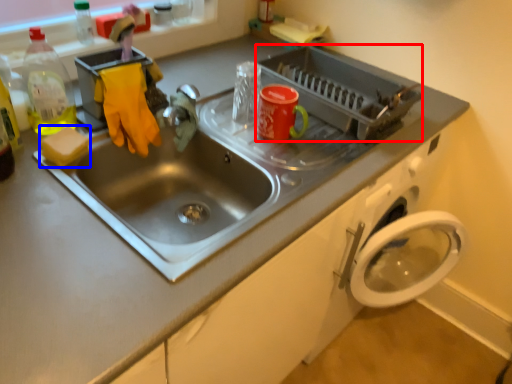
Question: Which object appears closest to the camera in this image, appliance (highlighted by a red box) or soap (highlighted by a blue box)?

Choices:
 (A) appliance
 (B) soap

Answer: (B)